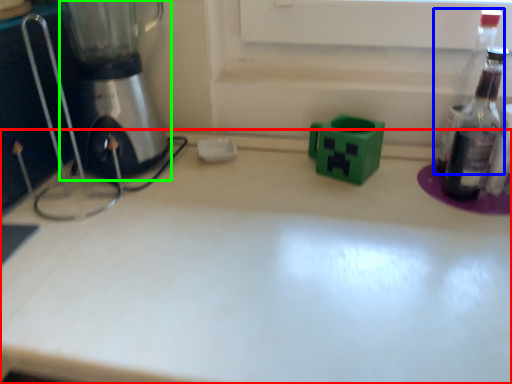
Question: Which is farther away from countertop (highlighted by a red box)? bottle (highlighted by a blue box) or mixer (highlighted by a green box)?

Choices:
 (A) bottle
 (B) mixer

Answer: (A)